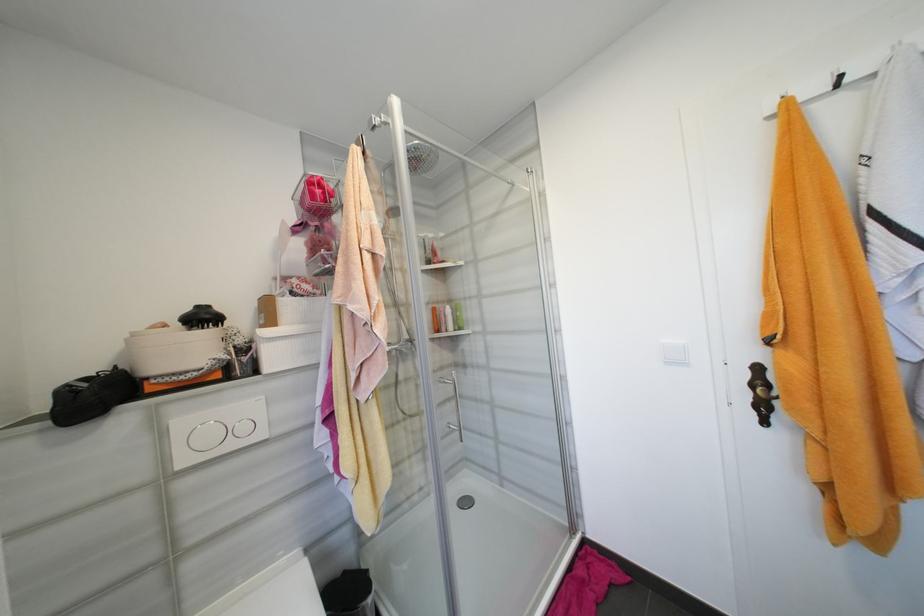
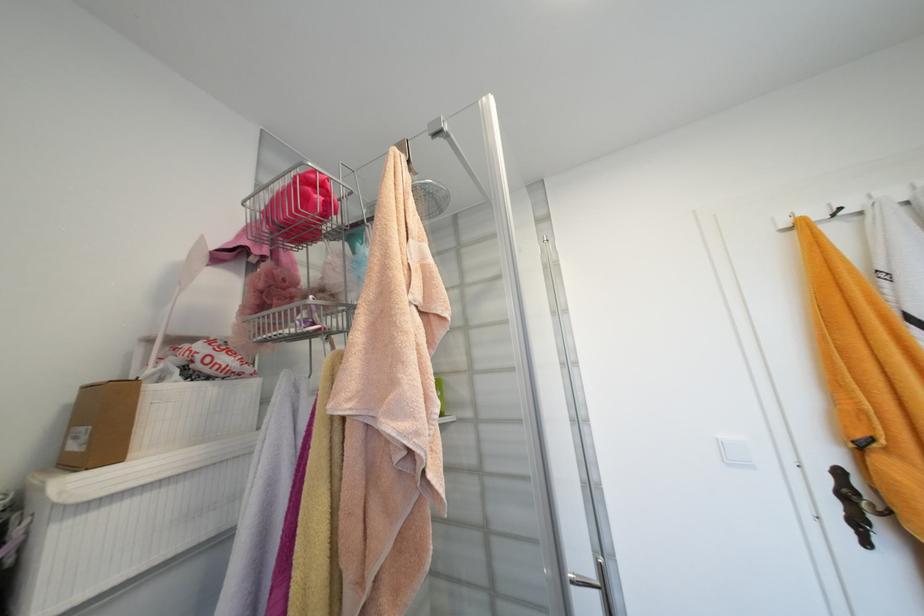
In the second image, find the point that corresponds to the point at 311,299 in the first image.

(224, 383)